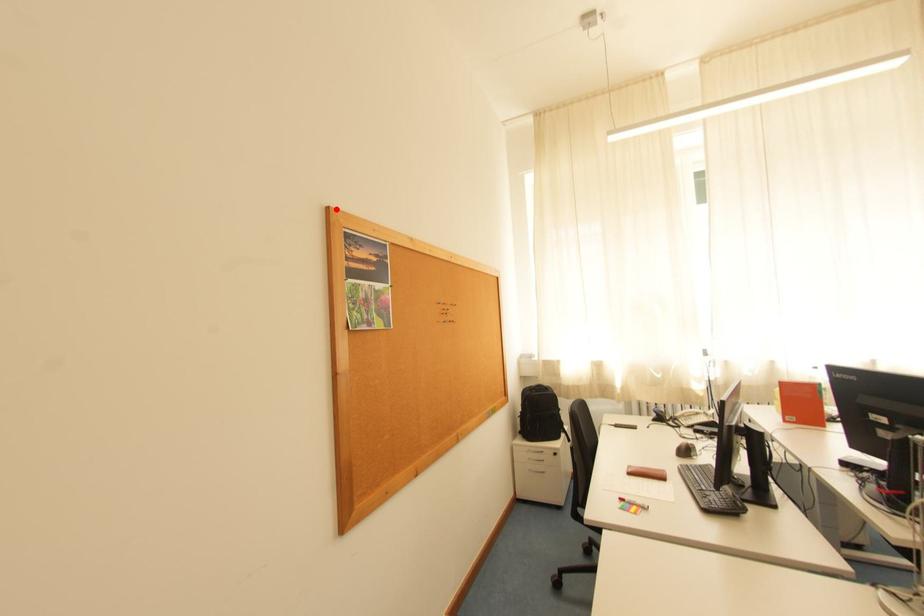
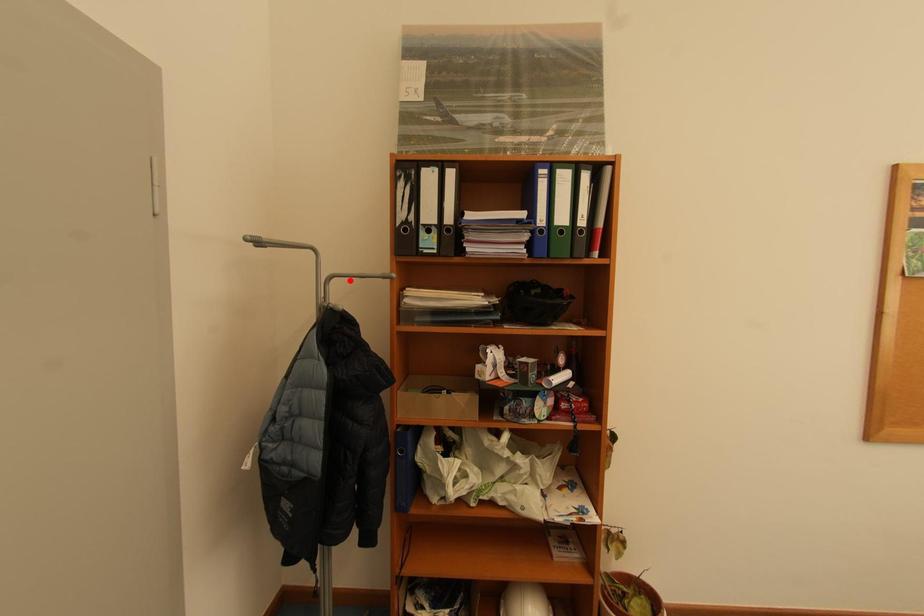
I am providing you with two images of the same scene from different viewpoints. A red point is marked on the first image and another point is marked on the second image. Is the red point in image1 aligned with the point shown in image2?

No